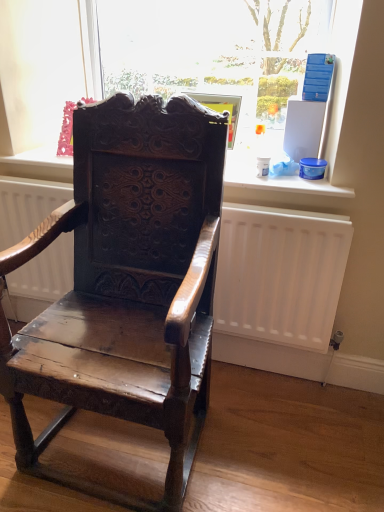
You are a GUI agent. You are given a task and a screenshot of the screen. Output one action in this format:
    pyautogui.click(x=<x>, y=<y>)
    Task: Click on the vacant space to the right of shiny dark wood chair at center
    The height and width of the screenshot is (512, 384).
    Given the screenshot: What is the action you would take?
    pyautogui.click(x=286, y=441)